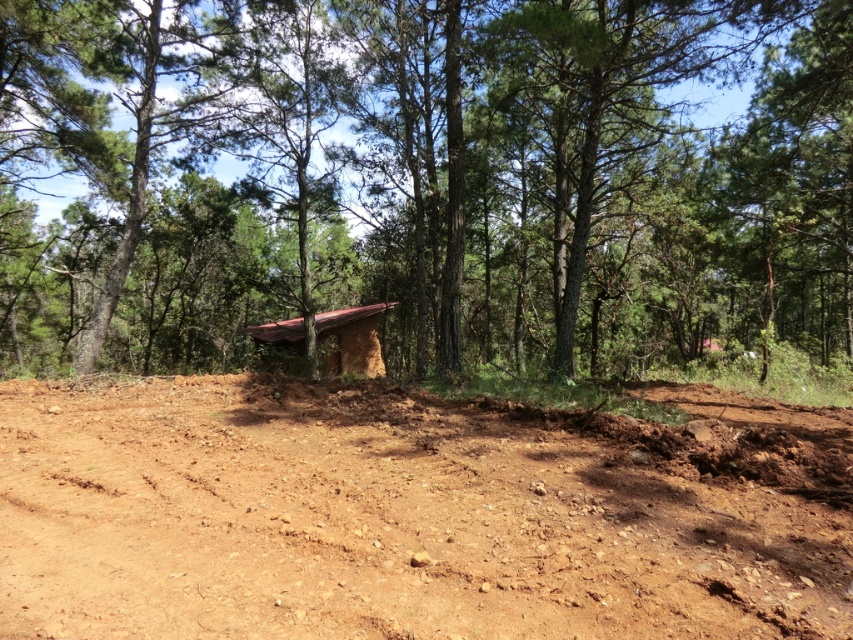
Question: Which point is closer to the camera?

Choices:
 (A) brown textured hut at center
 (B) brown mud hut at center

Answer: (A)

Question: Does brown textured hut at center have a greater width compared to brown mud hut at center?

Choices:
 (A) yes
 (B) no

Answer: (A)

Question: Is brown textured hut at center wider than brown mud hut at center?

Choices:
 (A) no
 (B) yes

Answer: (B)

Question: Is brown textured hut at center above brown soil at center?

Choices:
 (A) yes
 (B) no

Answer: (A)

Question: Considering the real-world distances, which object is closest to the brown mud hut at center?

Choices:
 (A) brown textured hut at center
 (B) brown soil at center

Answer: (A)

Question: Which point is closer to the camera taking this photo?

Choices:
 (A) (270, 208)
 (B) (386, 307)

Answer: (B)